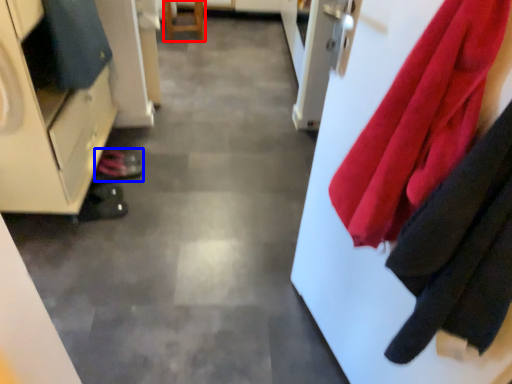
Question: Which point is further to the camera, furniture (highlighted by a red box) or shoe (highlighted by a blue box)?

Choices:
 (A) furniture
 (B) shoe

Answer: (A)